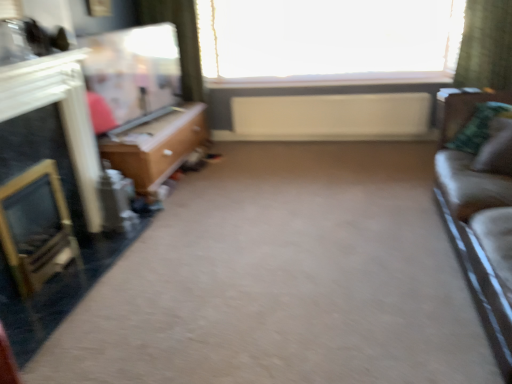
The image size is (512, 384). What do you see at coordinates (60, 116) in the screenshot?
I see `white glossy fireplace at left` at bounding box center [60, 116].

What do you see at coordinates (477, 127) in the screenshot? I see `green plaid pillow at right, which appears as the 2th pillow when viewed from the front` at bounding box center [477, 127].

In order to face green plaid pillow at right, which appears as the 2th pillow when viewed from the front, should I rotate leftwards or rightwards?

Turn right by 27.748 degrees to look at green plaid pillow at right, which appears as the 2th pillow when viewed from the front.

This screenshot has width=512, height=384. What are the coordinates of `white matte radiator at center` in the screenshot? It's located at (331, 116).

Where is `green fabric pillow at right, which ranks as the 2th pillow in back-to-front order`? This screenshot has height=384, width=512. green fabric pillow at right, which ranks as the 2th pillow in back-to-front order is located at coordinates (496, 149).

Is transparent glass window at upper center at the right side of wooden desk at left?

Yes, transparent glass window at upper center is to the right of wooden desk at left.

Looking at this image, from the image's perspective, which one is positioned lower, transparent glass window at upper center or wooden desk at left?

wooden desk at left is shown below in the image.

Considering the relative sizes of transparent glass window at upper center and wooden desk at left in the image provided, is transparent glass window at upper center wider than wooden desk at left?

Incorrect, the width of transparent glass window at upper center does not surpass that of wooden desk at left.

Can we say transparent glass window at upper center lies outside wooden desk at left?

Yes, transparent glass window at upper center is located beyond the bounds of wooden desk at left.

Considering the points (483, 223) and (50, 64), which point is behind, point (483, 223) or point (50, 64)?

The point (50, 64) is more distant.

From a real-world perspective, which object rests below the other?

leather couch at right.

Considering the sizes of leather couch at right and white glossy fireplace at left in the image, is leather couch at right taller or shorter than white glossy fireplace at left?

Clearly, leather couch at right is shorter compared to white glossy fireplace at left.

From the picture: Is leather couch at right oriented away from white glossy fireplace at left?

leather couch at right does not have its back to white glossy fireplace at left.

In the scene shown: Is white matte radiator at center bigger than leather couch at right?

Incorrect, white matte radiator at center is not larger than leather couch at right.

You are a GUI agent. You are given a task and a screenshot of the screen. Output one action in this format:
    pyautogui.click(x=<x>, y=<y>)
    Task: Click on the radiator behind the leather couch at right
    The height and width of the screenshot is (384, 512).
    Given the screenshot: What is the action you would take?
    pyautogui.click(x=331, y=116)

Relative to leather couch at right, is white matte radiator at center in front or behind?

Clearly, white matte radiator at center is behind leather couch at right.

Between point (390, 130) and point (457, 107), which one is positioned in front?

The point (457, 107) is closer.

Which is more to the right, wooden desk at left or green plaid pillow at right, the first pillow from the back?

From the viewer's perspective, green plaid pillow at right, the first pillow from the back, appears more on the right side.

Looking at their sizes, would you say wooden desk at left is wider or thinner than green plaid pillow at right, the first pillow from the back?

Clearly, wooden desk at left has more width compared to green plaid pillow at right, the first pillow from the back.

From a real-world perspective, is wooden desk at left located higher than green plaid pillow at right, the first pillow from the back?

No, from a real-world perspective, wooden desk at left is not above green plaid pillow at right, the first pillow from the back.

Is leather couch at right shorter than white matte radiator at center?

Incorrect, the height of leather couch at right does not fall short of that of white matte radiator at center.

Do you think leather couch at right is within white matte radiator at center, or outside of it?

The correct answer is: outside.

Looking at this image, does leather couch at right appear on the right side of white matte radiator at center?

Correct, you'll find leather couch at right to the right of white matte radiator at center.

Looking at this image, can you confirm if white matte radiator at center is smaller than white glossy fireplace at left?

Yes.

Does white matte radiator at center turn towards white glossy fireplace at left?

Yes, white matte radiator at center faces towards white glossy fireplace at left.

Considering the positions of objects white matte radiator at center and white glossy fireplace at left in the image provided, who is more to the right, white matte radiator at center or white glossy fireplace at left?

Positioned to the right is white matte radiator at center.

How different are the orientations of white matte radiator at center and white glossy fireplace at left in degrees?

There is a 91.2-degree angle between the facing directions of white matte radiator at center and white glossy fireplace at left.

Which is nearer, (x=226, y=18) or (x=334, y=112)?

Point (x=226, y=18).

In the scene shown: From a real-world perspective, is transparent glass window at upper center positioned above or below white matte radiator at center?

Clearly, from a real-world perspective, transparent glass window at upper center is above white matte radiator at center.

Locate an element on the screen. window behind the wooden desk at left is located at coordinates (328, 41).

The image size is (512, 384). Identify the location of fireplace above the leather couch at right (from the image's perspective). (60, 116).

When comparing their distances from green fabric pillow at right, arranged as the 1th pillow when viewed from the front, does white glossy fireplace at left or matte wood entertainment center at upper left seem further?

The object further to green fabric pillow at right, arranged as the 1th pillow when viewed from the front, is matte wood entertainment center at upper left.

Based on their spatial positions, is matte wood entertainment center at upper left or green fabric pillow at right, arranged as the 1th pillow when viewed from the front, further from transparent glass window at upper center?

green fabric pillow at right, arranged as the 1th pillow when viewed from the front, is positioned further to the anchor transparent glass window at upper center.

Based on their spatial positions, is leather couch at right or wooden desk at left closer to white glossy fireplace at left?

wooden desk at left.

From the picture: Which object lies nearer to the anchor point green plaid pillow at right, which appears as the 2th pillow when viewed from the front, white matte radiator at center or green fabric pillow at right, which ranks as the 2th pillow in back-to-front order?

green fabric pillow at right, which ranks as the 2th pillow in back-to-front order, is positioned closer to the anchor green plaid pillow at right, which appears as the 2th pillow when viewed from the front.

Estimate the real-world distances between objects in this image. Which object is further from transparent glass window at upper center, white matte radiator at center or green plaid pillow at right, the first pillow from the back?

Among the two, green plaid pillow at right, the first pillow from the back, is located further to transparent glass window at upper center.

Looking at the image, which one is located further to white glossy fireplace at left, white matte radiator at center or matte wood entertainment center at upper left?

white matte radiator at center is positioned further to the anchor white glossy fireplace at left.

From the image, which object appears to be nearer to white matte radiator at center, green plaid pillow at right, which appears as the 2th pillow when viewed from the front, or white glossy fireplace at left?

Based on the image, green plaid pillow at right, which appears as the 2th pillow when viewed from the front, appears to be nearer to white matte radiator at center.

Which object lies further to the anchor point green fabric pillow at right, which ranks as the 2th pillow in back-to-front order, white glossy fireplace at left or leather couch at right?

The object further to green fabric pillow at right, which ranks as the 2th pillow in back-to-front order, is white glossy fireplace at left.

This screenshot has height=384, width=512. I want to click on table between white glossy fireplace at left and white matte radiator at center along the z-axis, so click(x=156, y=146).

The image size is (512, 384). I want to click on entertainment center between white glossy fireplace at left and leather couch at right from left to right, so click(x=143, y=102).

In order to click on entertainment center positioned between leather couch at right and white matte radiator at center from near to far in this screenshot , I will do `click(143, 102)`.

Where is `window between white glossy fireplace at left and white matte radiator at center along the z-axis`? The width and height of the screenshot is (512, 384). window between white glossy fireplace at left and white matte radiator at center along the z-axis is located at coordinates (328, 41).